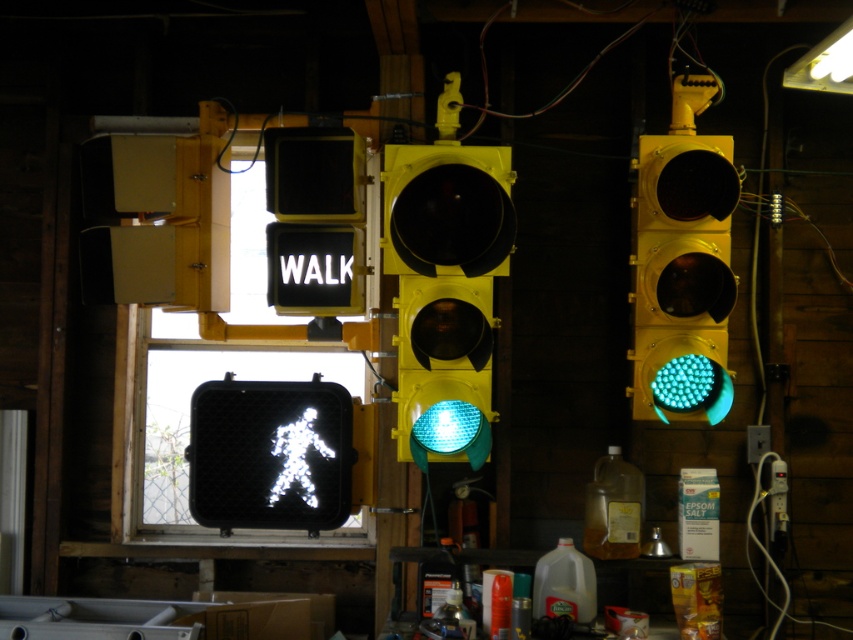
Which of these two, white plastic traffic light at upper left or white plastic sign at upper center, stands taller?

white plastic traffic light at upper left

What do you see at coordinates (160, 225) in the screenshot? I see `white plastic traffic light at upper left` at bounding box center [160, 225].

Between point (202, 186) and point (280, 284), which one is positioned in front?

Point (202, 186) is in front.

The height and width of the screenshot is (640, 853). What are the coordinates of `white plastic traffic light at upper left` in the screenshot? It's located at (160, 225).

Which is in front, point (462, 401) or point (202, 196)?

Point (462, 401) is more forward.

Can you confirm if yellow matte traffic light at center is thinner than white plastic traffic light at upper left?

Correct, yellow matte traffic light at center's width is less than white plastic traffic light at upper left's.

Locate an element on the screen. Image resolution: width=853 pixels, height=640 pixels. yellow matte traffic light at center is located at coordinates (445, 291).

Who is lower down, green matte traffic light at right or white plastic traffic light at upper left?

green matte traffic light at right is lower down.

Can you confirm if green matte traffic light at right is taller than white plastic traffic light at upper left?

Indeed, green matte traffic light at right has a greater height compared to white plastic traffic light at upper left.

Who is more distant from viewer, (675, 288) or (173, 196)?

Positioned behind is point (173, 196).

In order to click on green matte traffic light at right in this screenshot , I will do `click(682, 276)`.